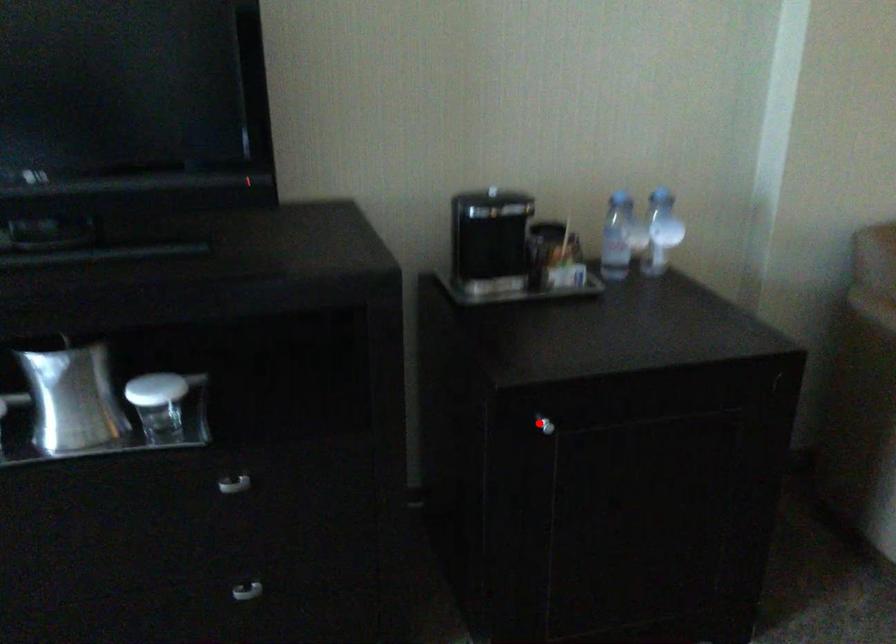
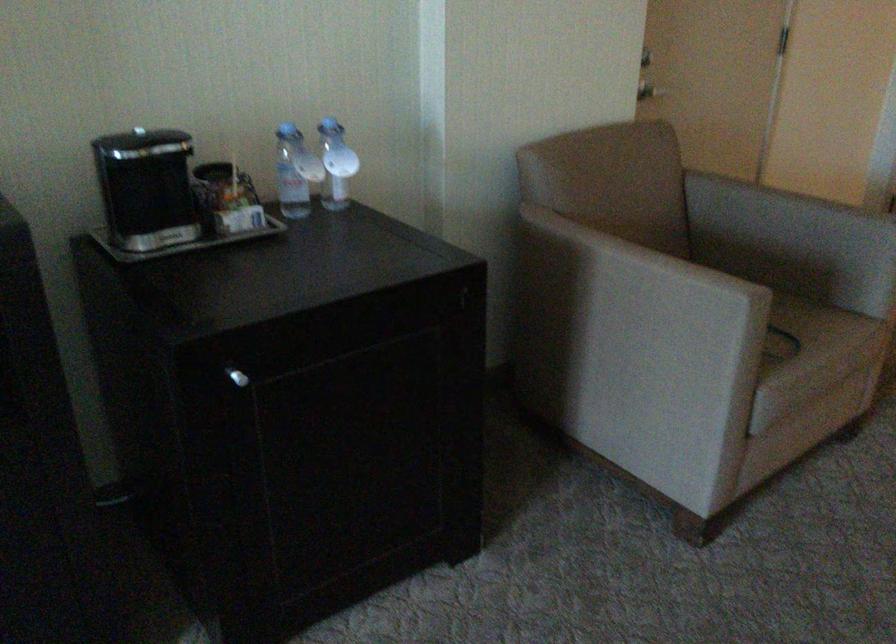
Where in the second image is the point corresponding to the highlighted location from the first image?

(237, 377)